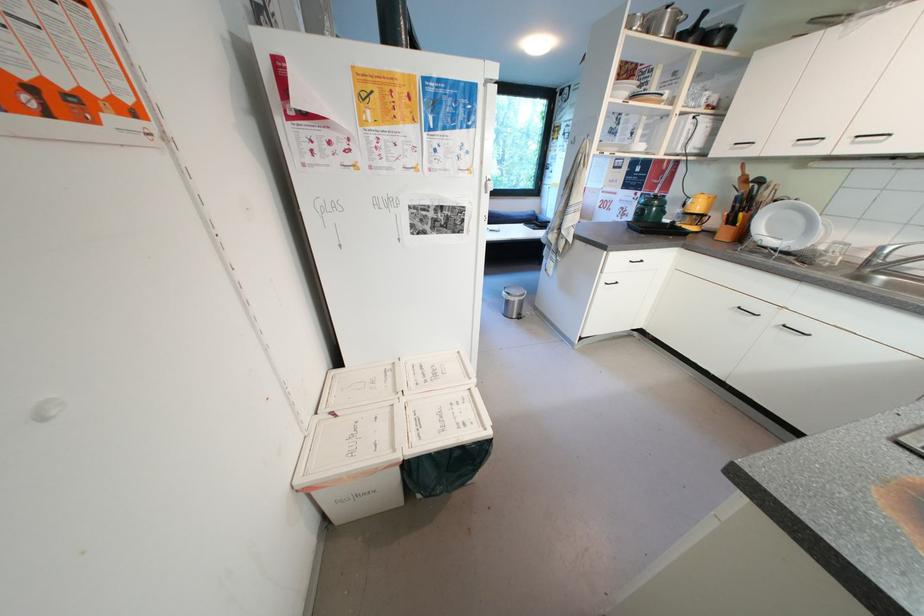
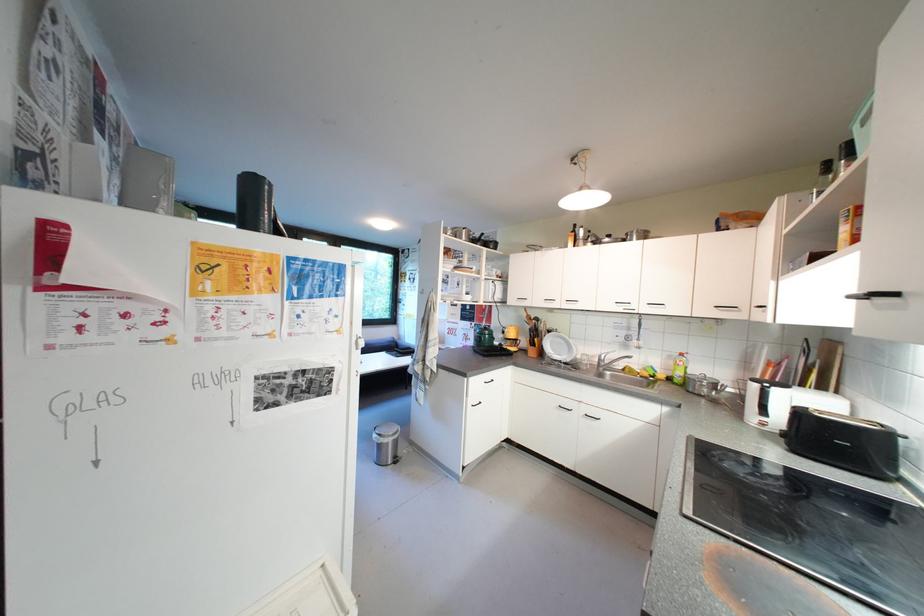
Where in the second image is the point corresponding to (x=614, y=280) from the first image?

(480, 402)